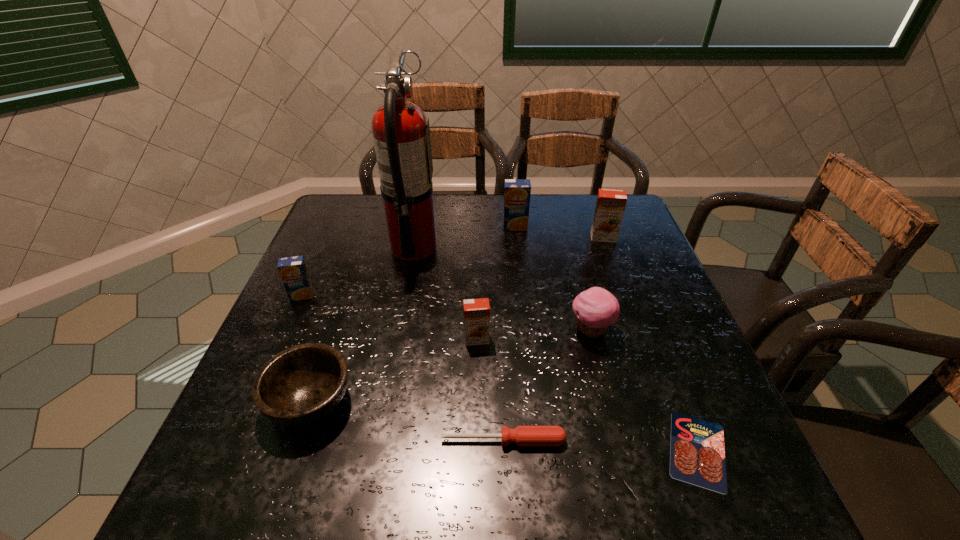
Identify the location of the sixth closest object to the third object from right to left. (401, 133).

You are a GUI agent. You are given a task and a screenshot of the screen. Output one action in this format:
    pyautogui.click(x=<x>, y=<y>)
    Task: Click on the object that is the sixth closest to the second orange juice from left to right
    
    Given the screenshot: What is the action you would take?
    pyautogui.click(x=293, y=271)

Locate an element on the screen. The width and height of the screenshot is (960, 540). orange juice object that ranks as the closest to the red screwdriver is located at coordinates (476, 311).

Find the location of `orange juice that is the closest to the third orange juice from left to right`. orange juice that is the closest to the third orange juice from left to right is located at coordinates (610, 206).

Identify the location of vacant area in the image that satisfies the following two spatial constraints: 1. on the front side of the right blue orange_juice; 2. on the left side of the third nearest orange juice. The width and height of the screenshot is (960, 540). (516, 238).

This screenshot has height=540, width=960. I want to click on free space that satisfies the following two spatial constraints: 1. on the back side of the second farthest orange juice; 2. on the left side of the smaller blue orange_juice, so click(327, 238).

This screenshot has height=540, width=960. In order to click on free point that satisfies the following two spatial constraints: 1. on the front side of the left orange orange juice; 2. on the left side of the second shortest object in this screenshot , I will do `click(476, 441)`.